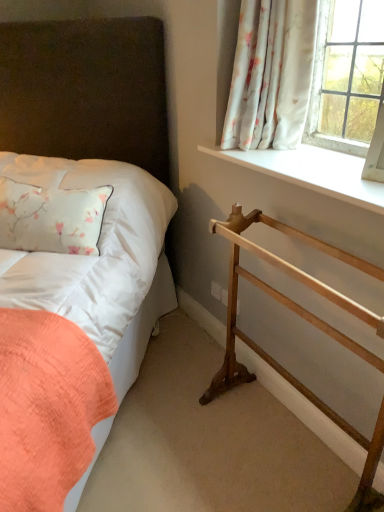
Locate an element on the screen. vacant space underneath white floral fabric at upper right (from a real-world perspective) is located at coordinates (263, 153).